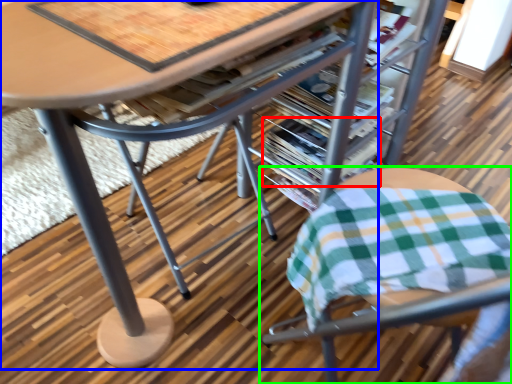
Question: Which is nearer to the magazine (highlighted by a red box)? table (highlighted by a blue box) or chair (highlighted by a green box).

Choices:
 (A) table
 (B) chair

Answer: (B)